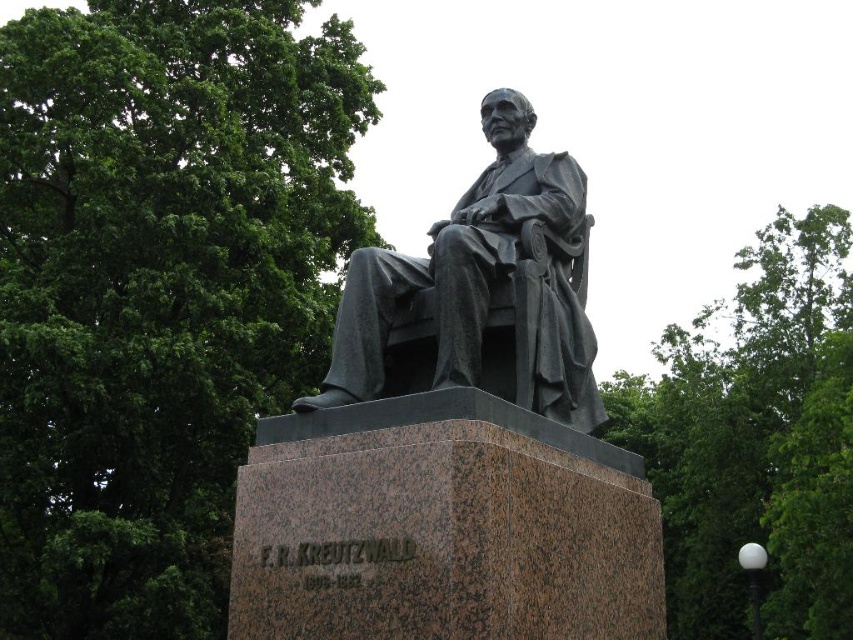
Is point (392, 513) positioned behind point (688, 612)?

No.

At what (x,y) coordinates should I click in order to perform the action: click on black polished granite statue at center. Please return your answer as a coordinate pair (x, y). The image size is (853, 640). Looking at the image, I should click on (456, 442).

The height and width of the screenshot is (640, 853). In order to click on black polished granite statue at center in this screenshot , I will do pyautogui.click(x=456, y=442).

Image resolution: width=853 pixels, height=640 pixels. I want to click on black polished granite statue at center, so click(456, 442).

Is black polished granite statue at center thinner than bronze statue at center?

No.

The image size is (853, 640). What are the coordinates of `black polished granite statue at center` in the screenshot? It's located at (456, 442).

The width and height of the screenshot is (853, 640). Find the location of `black polished granite statue at center`. black polished granite statue at center is located at coordinates (456, 442).

Which is below, green leafy tree at upper left or green leafy tree at upper right?

green leafy tree at upper right

Between green leafy tree at upper left and green leafy tree at upper right, which one has more height?

With more height is green leafy tree at upper right.

What are the coordinates of `green leafy tree at upper left` in the screenshot? It's located at [x=158, y=291].